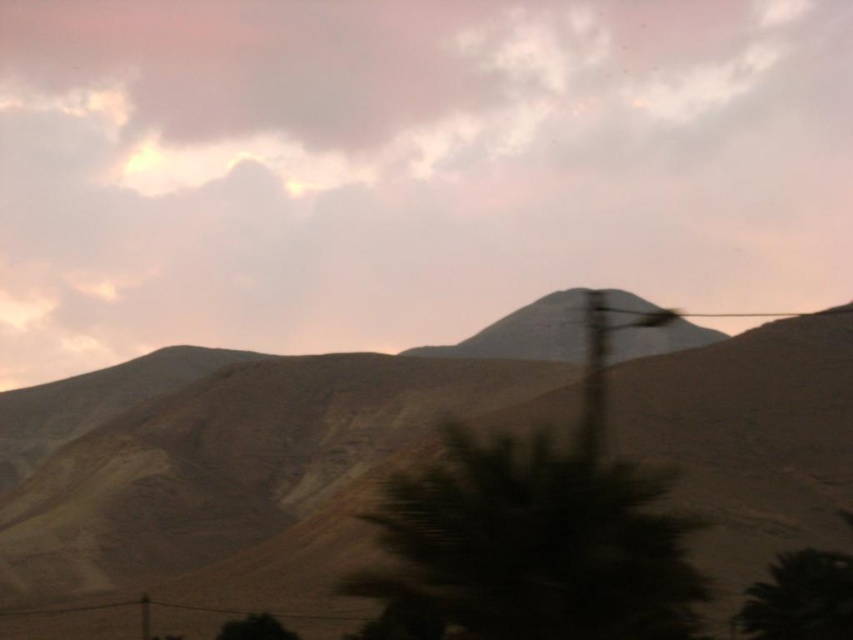
Does smokey pink cloud at upper center appear over dull brown mountain at center?

Yes.

Is point (457, 289) less distant than point (3, 508)?

That is False.

This screenshot has height=640, width=853. In order to click on smokey pink cloud at upper center in this screenshot , I will do `click(405, 166)`.